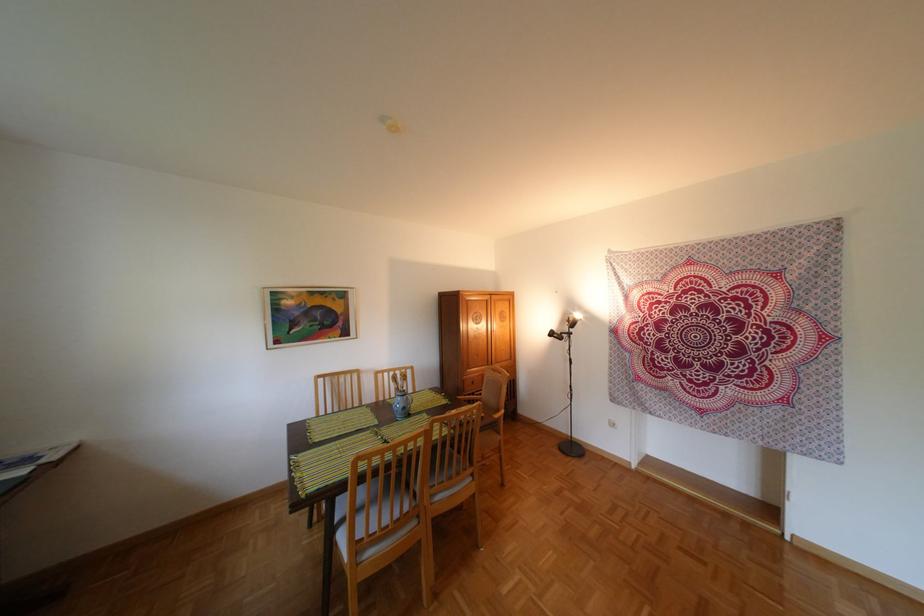
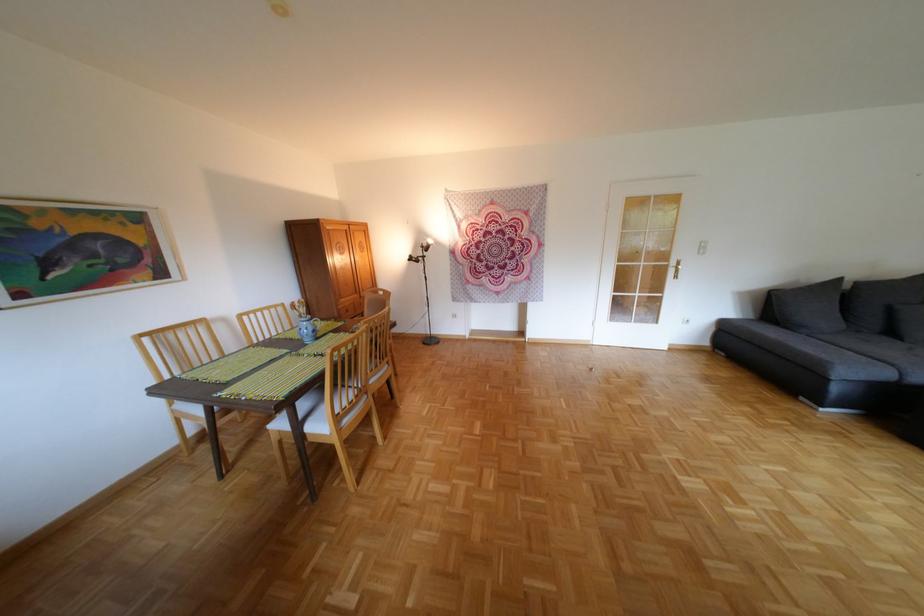
Find the pixel in the second image that matches [489,338] in the first image.

(356, 268)